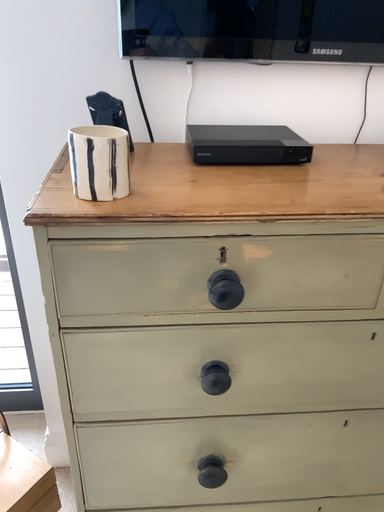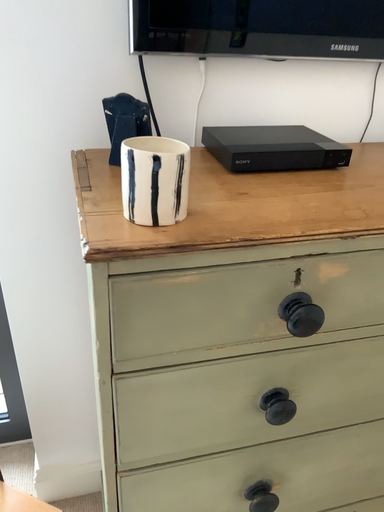
Question: How did the camera likely rotate when shooting the video?

Choices:
 (A) rotated left
 (B) rotated right

Answer: (B)